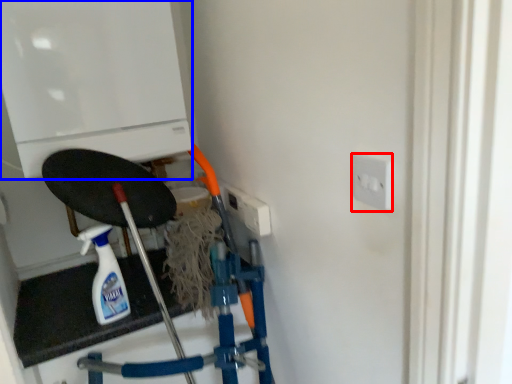
Question: Which object is closer to the camera taking this photo, socket (highlighted by a red box) or appliance (highlighted by a blue box)?

Choices:
 (A) socket
 (B) appliance

Answer: (A)